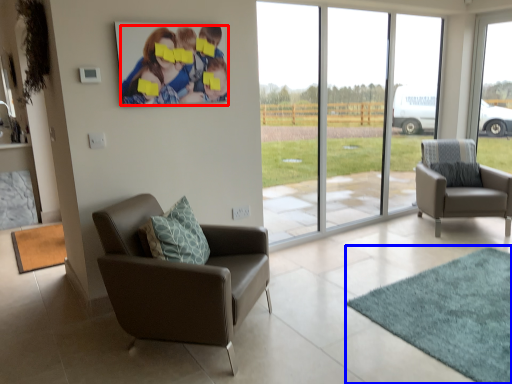
Question: Which object is further to the camera taking this photo, couple (highlighted by a red box) or mat (highlighted by a blue box)?

Choices:
 (A) couple
 (B) mat

Answer: (A)